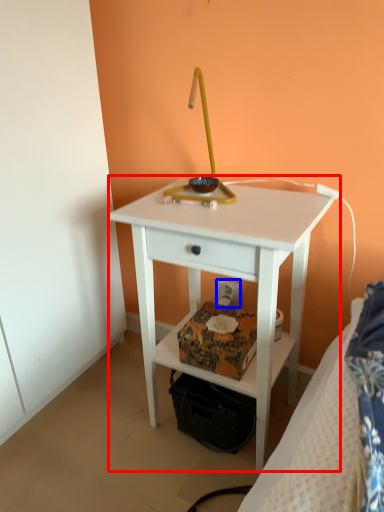
Question: Which object is closer to the camera taking this photo, nightstand (highlighted by a red box) or electric outlet (highlighted by a blue box)?

Choices:
 (A) nightstand
 (B) electric outlet

Answer: (A)